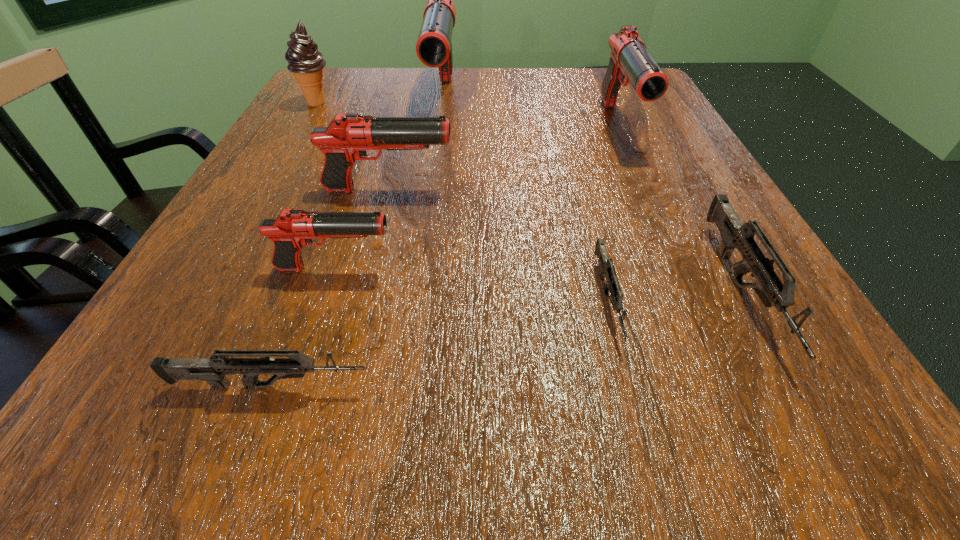
Where is `vacant space located 0.180m aimed along the barrel of the leftmost grey gun`? The width and height of the screenshot is (960, 540). vacant space located 0.180m aimed along the barrel of the leftmost grey gun is located at coordinates (535, 386).

At what (x,y) coordinates should I click in order to perform the action: click on vacant area situated aimed along the barrel of the second grey gun from left to right. Please return your answer as a coordinate pair (x, y). This screenshot has height=540, width=960. Looking at the image, I should click on (649, 456).

Locate an element on the screen. The image size is (960, 540). icecream that is at the far edge is located at coordinates (306, 63).

Locate an element on the screen. The width and height of the screenshot is (960, 540). icecream at the left edge is located at coordinates (306, 63).

Find the location of `object that is at the far left corner`. object that is at the far left corner is located at coordinates (306, 63).

The image size is (960, 540). Find the location of `object located at the near left corner`. object located at the near left corner is located at coordinates (213, 370).

You are a GUI agent. You are given a task and a screenshot of the screen. Output one action in this format:
    pyautogui.click(x=<x>, y=<y>)
    Task: Click on the object at the far right corner
    The height and width of the screenshot is (540, 960).
    Given the screenshot: What is the action you would take?
    pyautogui.click(x=629, y=57)

Where is `object located in the near right corner section of the desktop`? object located in the near right corner section of the desktop is located at coordinates (735, 234).

The width and height of the screenshot is (960, 540). In the image, there is a desktop. What are the coordinates of `vacant space at the far edge` in the screenshot? It's located at (477, 83).

In the image, there is a desktop. Identify the location of vacant space at the near edge. The height and width of the screenshot is (540, 960). (396, 457).